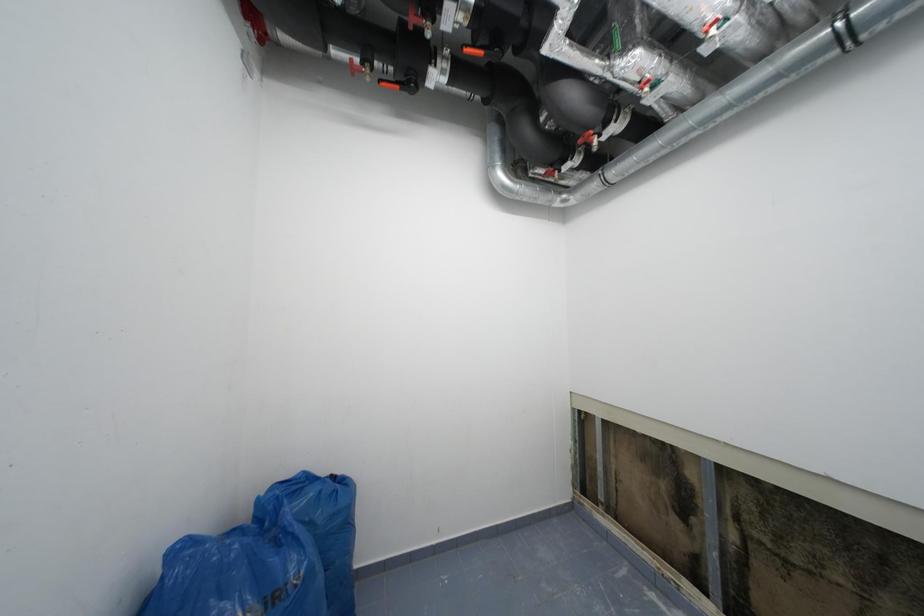
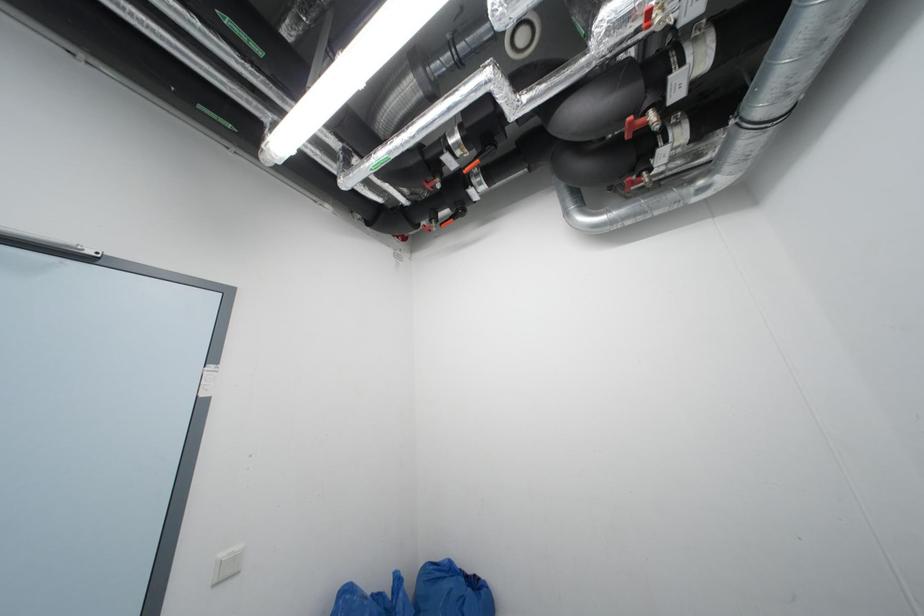
Based on the continuous images, in which direction is the camera rotating?

The rotation direction of the camera is left-up.